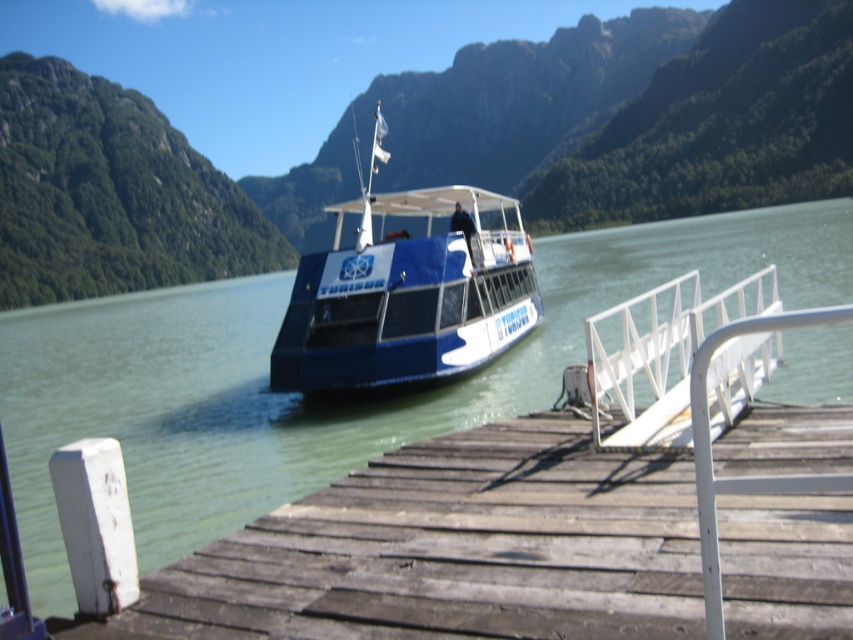
Question: Can you confirm if green textured mountain at upper left is thinner than blue polished wood boat at center?

Choices:
 (A) no
 (B) yes

Answer: (A)

Question: Which object appears closest to the camera in this image?

Choices:
 (A) blue polished wood boat at center
 (B) green textured mountain at upper left
 (C) white matte rail at center

Answer: (C)

Question: Is green textured mountain at upper left bigger than white matte rail at center?

Choices:
 (A) yes
 (B) no

Answer: (A)

Question: Can you confirm if blue polished wood boat at center is wider than white matte rail at center?

Choices:
 (A) yes
 (B) no

Answer: (A)

Question: Among these objects, which one is farthest from the camera?

Choices:
 (A) white matte rail at center
 (B) green textured mountain at upper left

Answer: (B)

Question: Which of the following is the closest to the observer?

Choices:
 (A) blue polished wood boat at center
 (B) white matte rail at center
 (C) green textured mountain at upper left
 (D) blue glossy boat at center

Answer: (B)